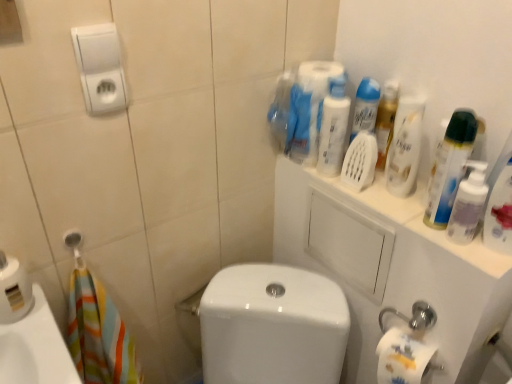
Image resolution: width=512 pixels, height=384 pixels. I want to click on blank area to the left of transparent plastic mouthwash at upper right, so click(401, 223).